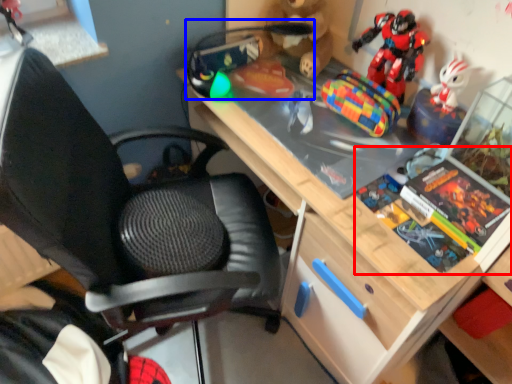
Question: Among these objects, which one is farthest to the camera, book (highlighted by a red box) or toy (highlighted by a blue box)?

Choices:
 (A) book
 (B) toy

Answer: (B)